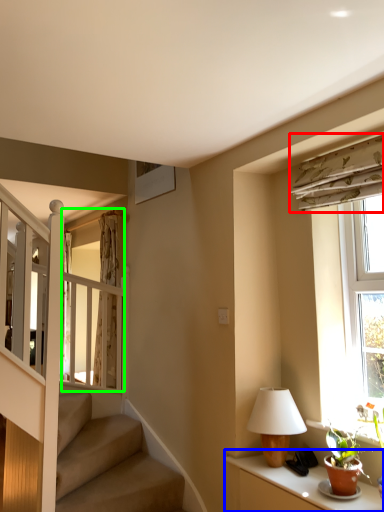
Question: Which object is the closest to the curtain (highlighted by a red box)? Choose among these: table (highlighted by a blue box) or glass door (highlighted by a green box).

Choices:
 (A) table
 (B) glass door

Answer: (A)